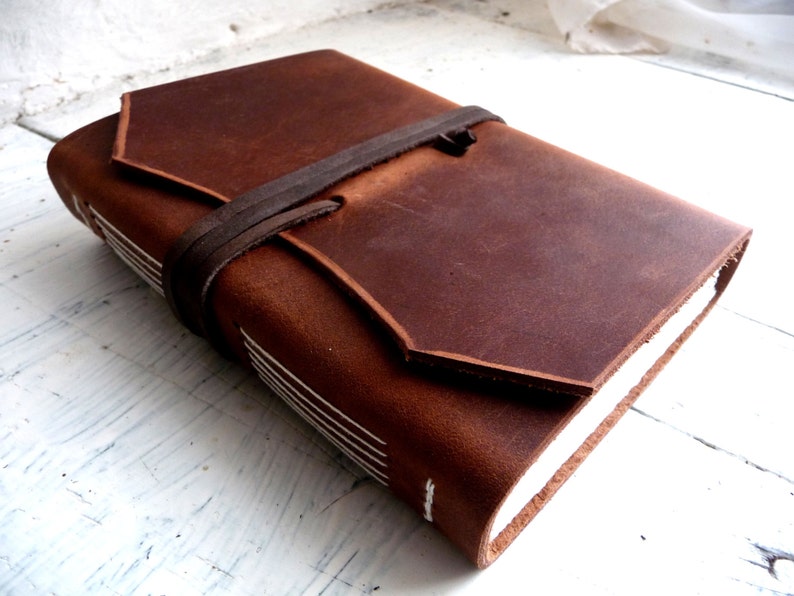
Find the location of `book`. book is located at coordinates (388, 207).